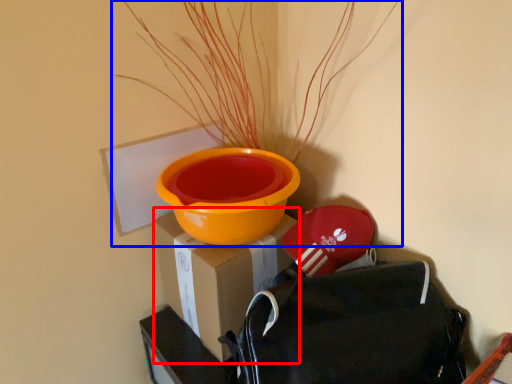
Question: Which of the following is the closest to the observer, cardboard box (highlighted by a red box) or houseplant (highlighted by a blue box)?

Choices:
 (A) cardboard box
 (B) houseplant

Answer: (B)